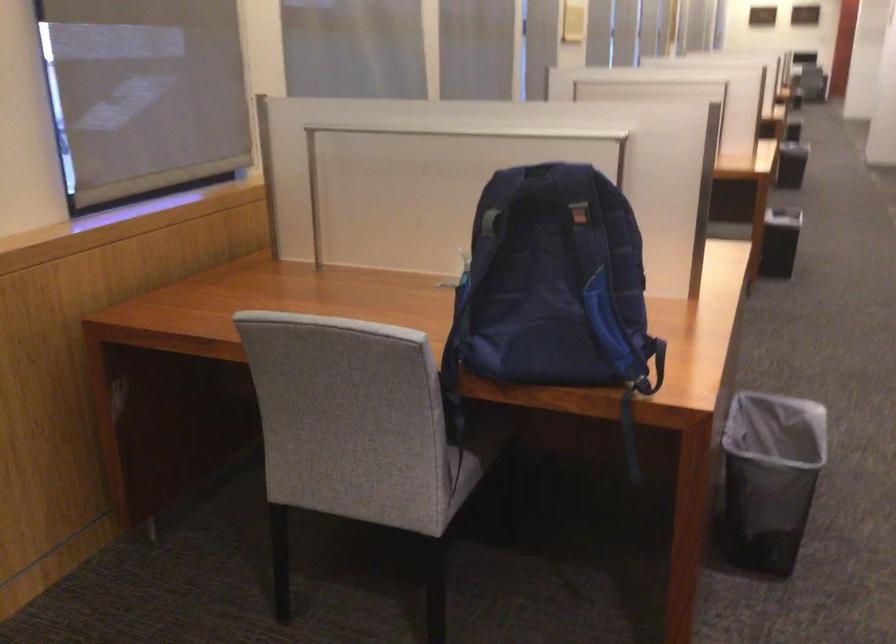
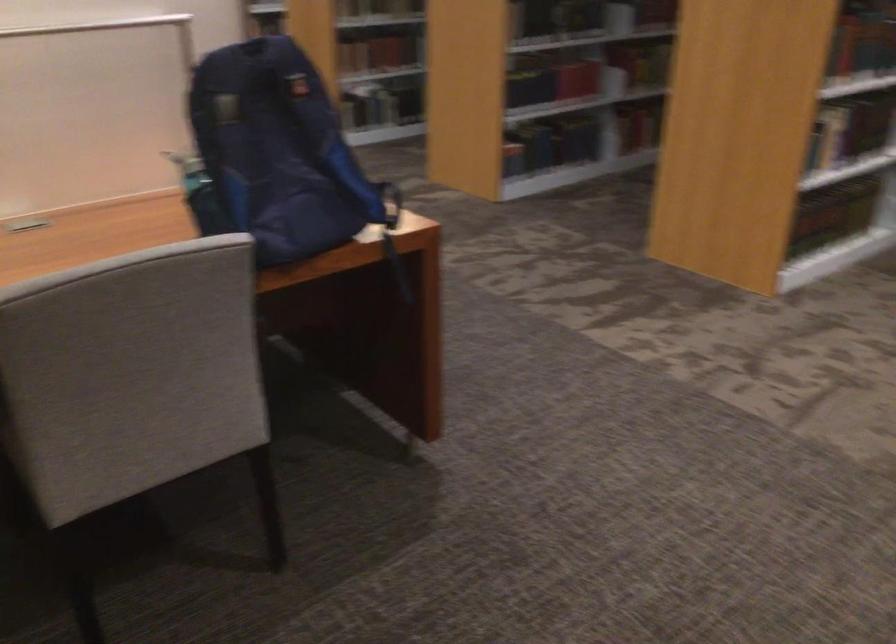
Where in the second image is the point corresponding to point (455, 292) from the first image?

(200, 194)